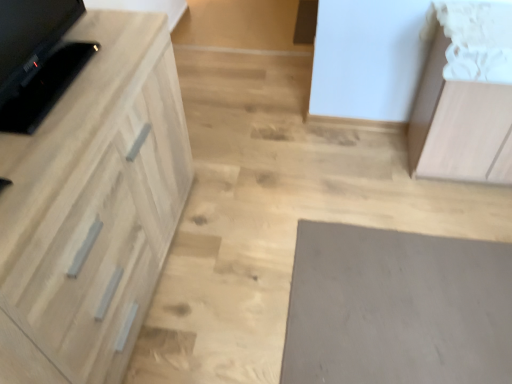
The image size is (512, 384). Identify the location of vacant space in between gray matte mat at lower right and light wood cabinet at left, the 1th cabinetry when ordered from left to right. (244, 264).